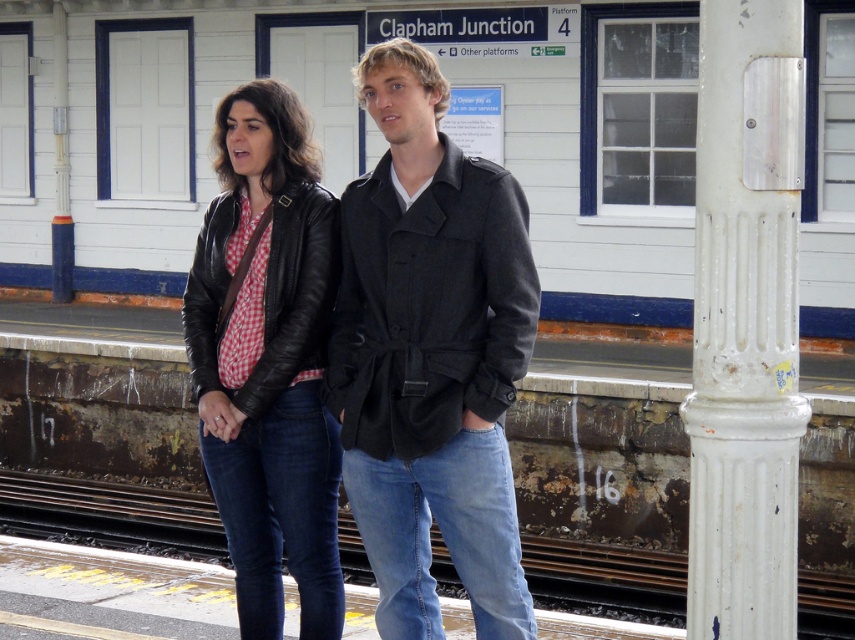
Between matte black jacket at center and leather jacket at center, which one appears on the right side from the viewer's perspective?

Positioned to the right is matte black jacket at center.

Who is shorter, matte black jacket at center or leather jacket at center?

matte black jacket at center is shorter.

Between point (402, 365) and point (290, 396), which one is positioned behind?

The point (290, 396) is more distant.

Identify the location of matte black jacket at center. (431, 355).

Who is higher up, white painted metal pole at right or rusty metal train track at lower center?

white painted metal pole at right is higher up.

Does white painted metal pole at right appear under rusty metal train track at lower center?

No, white painted metal pole at right is not below rusty metal train track at lower center.

Which is in front, point (773, 429) or point (13, 525)?

Point (773, 429) is more forward.

Locate an element on the screen. The image size is (855, 640). white painted metal pole at right is located at coordinates (741, 348).

Who is positioned more to the left, leather jacket at center or white painted metal pole at right?

leather jacket at center

Who is more forward, (252, 232) or (753, 381)?

Point (753, 381)

Identify the location of leather jacket at center. Image resolution: width=855 pixels, height=640 pixels. (268, 358).